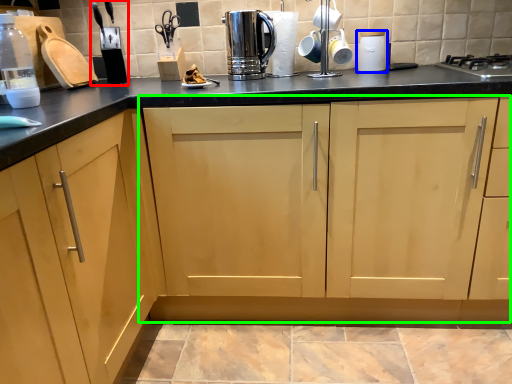
Question: Considering the real-world distances, which object is farthest from appliance (highlighted by a red box)? appliance (highlighted by a blue box) or cabinetry (highlighted by a green box)?

Choices:
 (A) appliance
 (B) cabinetry

Answer: (A)